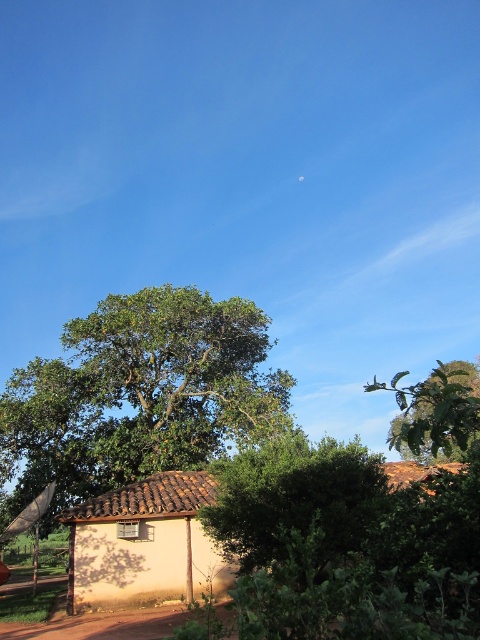
Question: Where is green leafy tree at upper right located in relation to brown dirt track at lower left in the image?

Choices:
 (A) above
 (B) below

Answer: (B)

Question: Which point is farther to the camera?

Choices:
 (A) click(141, 566)
 (B) click(144, 451)

Answer: (B)

Question: Which point is closer to the camera taking this photo?

Choices:
 (A) (x=127, y=362)
 (B) (x=471, y=426)

Answer: (B)

Question: Does beige clay hut at center come behind brown dirt track at lower left?

Choices:
 (A) yes
 (B) no

Answer: (A)

Question: Among these objects, which one is nearest to the camera?

Choices:
 (A) beige clay hut at center
 (B) brown dirt track at lower left

Answer: (B)

Question: Is beige clay hut at center wider than brown dirt track at lower left?

Choices:
 (A) yes
 (B) no

Answer: (B)